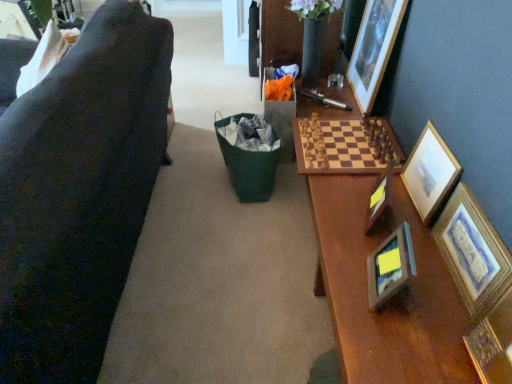
The height and width of the screenshot is (384, 512). Describe the element at coordinates (380, 198) in the screenshot. I see `wooden picture frame at right, the 4th picture frame viewed from the right` at that location.

What is the approximate height of gold-framed picture at right, the 2th picture frame viewed from the right?

The height of gold-framed picture at right, the 2th picture frame viewed from the right, is 13.16 inches.

Find the location of a particular element. wooden picture frame at upper left, the first picture frame when ordered from left to right is located at coordinates (16, 21).

Measure the distance between point [318,167] and camera.

The distance of point [318,167] from camera is 6.10 feet.

Find the location of a particular element. Image resolution: width=512 pixels, height=384 pixels. wooden framed print at right, which appears as the 1th picture frame when viewed from the right is located at coordinates (472, 252).

I want to click on wooden picture frame at right, acting as the 3th picture frame starting from the left, so [x=380, y=198].

Is wooden chessboard at center oriented towards wooden picture frame at right, acting as the 3th picture frame starting from the left?

No, wooden chessboard at center is not aimed at wooden picture frame at right, acting as the 3th picture frame starting from the left.

Which point is more distant from viewer, (370,163) or (376,199)?

The point (370,163) is more distant.

Who is bigger, wooden chessboard at center or wooden picture frame at right, acting as the 3th picture frame starting from the left?

wooden chessboard at center.

From a real-world perspective, is wooden chessboard at center located higher than wooden picture frame at right, the 4th picture frame viewed from the right?

No, from a real-world perspective, wooden chessboard at center is not over wooden picture frame at right, the 4th picture frame viewed from the right

Is there a large distance between wooden picture frame at right, the 4th picture frame viewed from the right, and wooden photo frame at center, positioned as the fifth picture frame in right-to-left order?

They are positioned close to each other.

Between wooden picture frame at right, the 4th picture frame viewed from the right, and wooden photo frame at center, positioned as the fifth picture frame in right-to-left order, which one has larger width?

Wider between the two is wooden photo frame at center, positioned as the fifth picture frame in right-to-left order.

From the image's perspective, which is above, wooden picture frame at right, the 4th picture frame viewed from the right, or wooden photo frame at center, positioned as the fifth picture frame in right-to-left order?

wooden picture frame at right, the 4th picture frame viewed from the right, is shown above in the image.

From a real-world perspective, is wooden picture frame at right, the 4th picture frame viewed from the right, under wooden photo frame at center, positioned as the fifth picture frame in right-to-left order?

Yes, from a real-world perspective, wooden picture frame at right, the 4th picture frame viewed from the right, is beneath wooden photo frame at center, positioned as the fifth picture frame in right-to-left order.

From the image's perspective, does wooden chessboard at center appear lower than wooden picture frame at upper left, the first picture frame when ordered from left to right?

Correct, wooden chessboard at center appears lower than wooden picture frame at upper left, the first picture frame when ordered from left to right, in the image.

Is wooden picture frame at upper left, the first picture frame when ordered from left to right, at the back of wooden chessboard at center?

No, wooden chessboard at center's orientation is not away from wooden picture frame at upper left, the first picture frame when ordered from left to right.

Is wooden chessboard at center far away from wooden picture frame at upper left, the first picture frame when ordered from left to right?

Yes, wooden chessboard at center is far from wooden picture frame at upper left, the first picture frame when ordered from left to right.

From their relative heights in the image, would you say wooden photo frame at center, which is the 2th picture frame from left to right, is taller or shorter than wooden chessboard at center?

In the image, wooden photo frame at center, which is the 2th picture frame from left to right, appears to be taller than wooden chessboard at center.

Is wooden photo frame at center, positioned as the fifth picture frame in right-to-left order, smaller than wooden chessboard at center?

Indeed, wooden photo frame at center, positioned as the fifth picture frame in right-to-left order, has a smaller size compared to wooden chessboard at center.

Are wooden photo frame at center, positioned as the fifth picture frame in right-to-left order, and wooden chessboard at center located far from each other?

No.

Which of these two, wooden photo frame at center, positioned as the fifth picture frame in right-to-left order, or wooden chessboard at center, is wider?

Wider between the two is wooden chessboard at center.

What are the coordinates of `picture frame that is the 2nd one when counting forward from the wooden picture frame at upper right, the fourth picture frame viewed from the left` in the screenshot? It's located at (430, 173).

From the image's perspective, is gold-framed picture at right, the 5th picture frame viewed from the left, above wooden picture frame at upper right, the fourth picture frame viewed from the left?

No.

In terms of size, does gold-framed picture at right, the 5th picture frame viewed from the left, appear bigger or smaller than wooden picture frame at upper right, the fourth picture frame viewed from the left?

Considering their sizes, gold-framed picture at right, the 5th picture frame viewed from the left, takes up less space than wooden picture frame at upper right, the fourth picture frame viewed from the left.

Which object is closer to the camera taking this photo, gold-framed picture at right, the 2th picture frame viewed from the right, or wooden picture frame at upper right, the fourth picture frame viewed from the left?

Positioned in front is gold-framed picture at right, the 2th picture frame viewed from the right.

From the image's perspective, is wooden photo frame at center, which is the 2th picture frame from left to right, over gold-framed picture at right, the 2th picture frame viewed from the right?

No, from the image's perspective, wooden photo frame at center, which is the 2th picture frame from left to right, is not above gold-framed picture at right, the 2th picture frame viewed from the right.

From a real-world perspective, relative to gold-framed picture at right, the 5th picture frame viewed from the left, is wooden photo frame at center, which is the 2th picture frame from left to right, vertically above or below?

From a real-world perspective, wooden photo frame at center, which is the 2th picture frame from left to right, is physically below gold-framed picture at right, the 5th picture frame viewed from the left.

From the wooden photo frame at center, positioned as the fifth picture frame in right-to-left order, count 3rd picture frame to the right and point to it. Please provide its 2D coordinates.

[(430, 173)]

Is wooden photo frame at center, positioned as the fifth picture frame in right-to-left order, far from gold-framed picture at right, the 2th picture frame viewed from the right?

No, wooden photo frame at center, positioned as the fifth picture frame in right-to-left order, is not far from gold-framed picture at right, the 2th picture frame viewed from the right.

Between wooden picture frame at right, acting as the 3th picture frame starting from the left, and wooden framed print at right, the sixth picture frame from the left, which one appears on the right side from the viewer's perspective?

wooden framed print at right, the sixth picture frame from the left, is more to the right.

Considering the points (384, 210) and (473, 281), which point is behind, point (384, 210) or point (473, 281)?

Positioned behind is point (384, 210).

In the scene shown: From the image's perspective, which object appears higher, wooden picture frame at right, acting as the 3th picture frame starting from the left, or wooden framed print at right, which appears as the 1th picture frame when viewed from the right?

wooden picture frame at right, acting as the 3th picture frame starting from the left, from the image's perspective.

Does wooden picture frame at right, the 4th picture frame viewed from the right, touch wooden framed print at right, the sixth picture frame from the left?

No.

Find the location of a particular element. board game below the wooden picture frame at right, acting as the 3th picture frame starting from the left (from a real-world perspective) is located at coordinates (343, 146).

From the wooden picture frame at right, the 4th picture frame viewed from the right, count the 1st picture frame to the left and point to it. Please provide its 2D coordinates.

[(390, 267)]

Based on their spatial positions, is gold-framed picture at right, the 5th picture frame viewed from the left, or wooden picture frame at right, the 4th picture frame viewed from the right, further from wooden picture frame at upper left, the first picture frame when ordered from left to right?

The object further to wooden picture frame at upper left, the first picture frame when ordered from left to right, is gold-framed picture at right, the 5th picture frame viewed from the left.

Considering their positions, is wooden photo frame at center, which is the 2th picture frame from left to right, positioned closer to gold-framed picture at right, the 2th picture frame viewed from the right, than wooden chessboard at center?

The object closer to gold-framed picture at right, the 2th picture frame viewed from the right, is wooden photo frame at center, which is the 2th picture frame from left to right.

From the image, which object appears to be nearer to wooden picture frame at upper right, which ranks as the third picture frame in right-to-left order, wooden chessboard at center or wooden picture frame at upper left, the first picture frame when ordered from left to right?

Among the two, wooden chessboard at center is located nearer to wooden picture frame at upper right, which ranks as the third picture frame in right-to-left order.

Looking at the image, which one is located closer to wooden picture frame at upper left, acting as the 6th picture frame starting from the right, gold-framed picture at right, the 2th picture frame viewed from the right, or wooden photo frame at center, which is the 2th picture frame from left to right?

gold-framed picture at right, the 2th picture frame viewed from the right, is positioned closer to the anchor wooden picture frame at upper left, acting as the 6th picture frame starting from the right.

Estimate the real-world distances between objects in this image. Which object is closer to wooden framed print at right, the sixth picture frame from the left, wooden picture frame at upper right, which ranks as the third picture frame in right-to-left order, or wooden photo frame at center, which is the 2th picture frame from left to right?

wooden photo frame at center, which is the 2th picture frame from left to right, is closer to wooden framed print at right, the sixth picture frame from the left.

When comparing their distances from wooden picture frame at upper right, which ranks as the third picture frame in right-to-left order, does wooden framed print at right, which appears as the 1th picture frame when viewed from the right, or gold-framed picture at right, the 5th picture frame viewed from the left, seem further?

wooden framed print at right, which appears as the 1th picture frame when viewed from the right, is positioned further to the anchor wooden picture frame at upper right, which ranks as the third picture frame in right-to-left order.

Based on their spatial positions, is wooden picture frame at upper right, which ranks as the third picture frame in right-to-left order, or gold-framed picture at right, the 5th picture frame viewed from the left, closer to wooden picture frame at upper left, acting as the 6th picture frame starting from the right?

wooden picture frame at upper right, which ranks as the third picture frame in right-to-left order, is closer to wooden picture frame at upper left, acting as the 6th picture frame starting from the right.

Estimate the real-world distances between objects in this image. Which object is further from wooden framed print at right, which appears as the 1th picture frame when viewed from the right, wooden chessboard at center or gold-framed picture at right, the 5th picture frame viewed from the left?

Based on the image, wooden chessboard at center appears to be further to wooden framed print at right, which appears as the 1th picture frame when viewed from the right.

I want to click on picture frame between wooden picture frame at upper left, acting as the 6th picture frame starting from the right, and wooden chessboard at center, so [390, 267].

At what (x,y) coordinates should I click in order to perform the action: click on board game that lies between wooden picture frame at upper right, the fourth picture frame viewed from the left, and gold-framed picture at right, the 2th picture frame viewed from the right, from top to bottom. Please return your answer as a coordinate pair (x, y). Looking at the image, I should click on (343, 146).

In order to click on board game located between wooden picture frame at upper left, acting as the 6th picture frame starting from the right, and gold-framed picture at right, the 2th picture frame viewed from the right, in the left-right direction in this screenshot , I will do pyautogui.click(x=343, y=146).

Locate an element on the screen. Image resolution: width=512 pixels, height=384 pixels. board game situated between wooden picture frame at upper left, the first picture frame when ordered from left to right, and wooden picture frame at upper right, the fourth picture frame viewed from the left, from left to right is located at coordinates (343, 146).